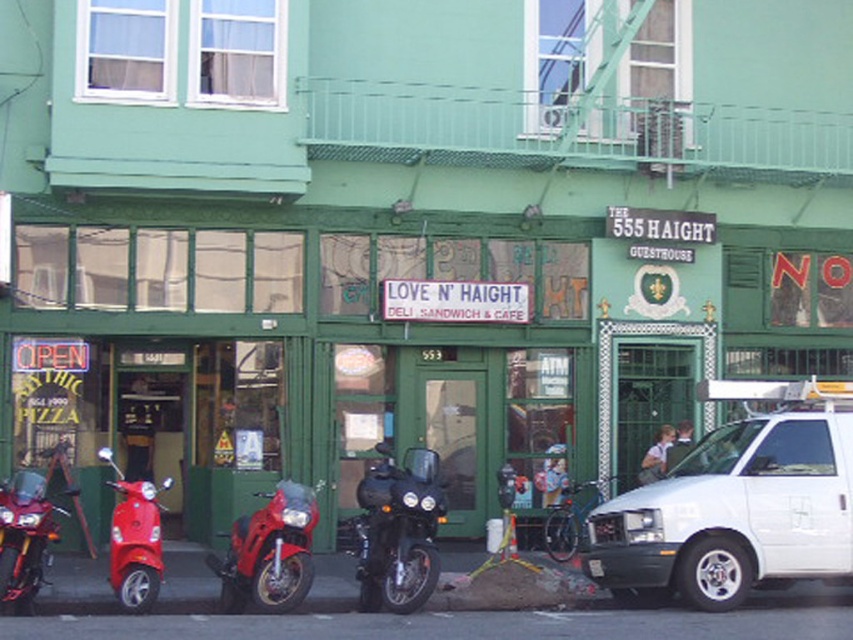
You are a delivery person who needs to load a large package onto a motorcycle. The shiny red motorcycle at center and the shiny red motorcycle at left are both available. Which motorcycle would allow you to place the package higher due to its height?

The shiny red motorcycle at center has a greater height compared to the shiny red motorcycle at left, so it would allow you to place the package higher.

You are a delivery person trying to park your scooter in front of the 555 Haight Guesthouse. You see the shiny black motorcycle at center and the shiny red scooter at lower left. Which vehicle is closer to you so you can park behind it?

Answer: The shiny black motorcycle at center is closer to you, so you can park behind it.